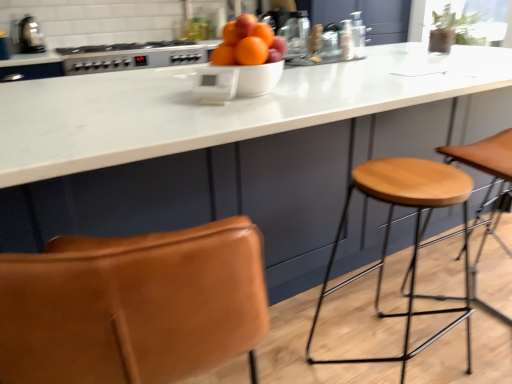
At what (x,y) coordinates should I click in order to perform the action: click on free point to the left of white glossy bowl at center. Please return your answer as a coordinate pair (x, y). Looking at the image, I should click on (170, 91).